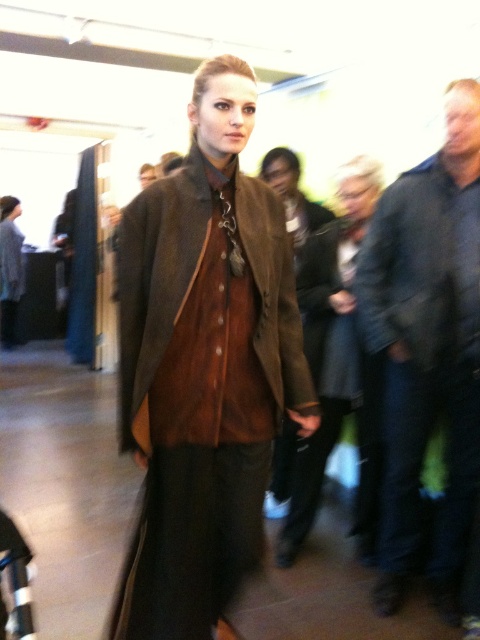
You are a photographer at the runway show and need to capture a photo of the dark blue denim jeans at right and dark blue textured jacket at right. Which of these two items is taller?

The dark blue denim jeans at right is taller than the dark blue textured jacket at right.

You are a photographer at the runway event. You need to capture a photo where the dark blue denim jeans at right and the brown suede coat at center are both visible. However, your camera has a limited depth of field. Which object should you focus on to ensure both are in focus?

Since the dark blue denim jeans at right is taller than the brown suede coat at center, you should focus on the dark blue denim jeans at right to ensure both objects are in focus.

You are a photographer at the runway show and need to position your camera to capture the brown suede coat at center. What are the coordinates where you should aim your camera?

The coordinates for the brown suede coat at center are at point (156, 282), so you should aim your camera there.